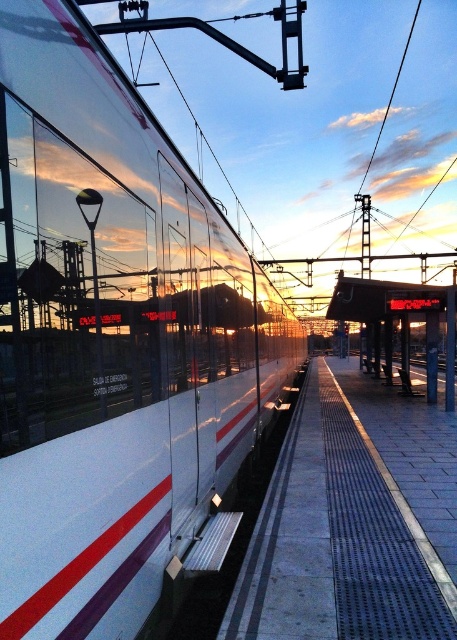
From the picture: Does white glossy train at center appear over smooth concrete platform at center?

Yes.

Image resolution: width=457 pixels, height=640 pixels. What are the coordinates of `white glossy train at center` in the screenshot? It's located at (115, 342).

At what (x,y) coordinates should I click in order to perform the action: click on white glossy train at center. Please return your answer as a coordinate pair (x, y). Looking at the image, I should click on (115, 342).

Measure the distance between white glossy train at center and metallic platform at center.

white glossy train at center is 27.49 feet from metallic platform at center.

Between white glossy train at center and metallic platform at center, which one has more height?

metallic platform at center is taller.

What do you see at coordinates (115, 342) in the screenshot? I see `white glossy train at center` at bounding box center [115, 342].

Image resolution: width=457 pixels, height=640 pixels. Find the location of `white glossy train at center`. white glossy train at center is located at coordinates (x=115, y=342).

Measure the distance between smooth concrete platform at center and metallic platform at center.

smooth concrete platform at center is 4.55 meters away from metallic platform at center.

In the scene shown: Does smooth concrete platform at center have a lesser height compared to metallic platform at center?

Yes, smooth concrete platform at center is shorter than metallic platform at center.

Which is behind, point (375, 442) or point (383, 282)?

The point (383, 282) is more distant.

Find the location of `smooth concrete platform at center`. smooth concrete platform at center is located at coordinates (354, 520).